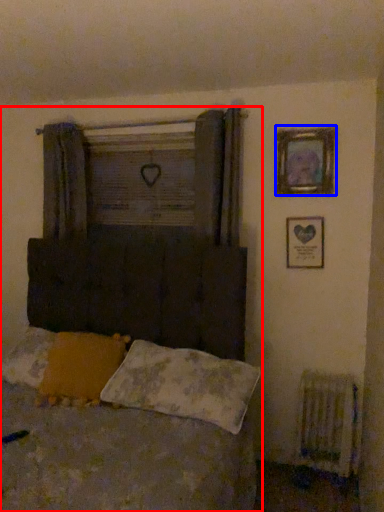
Question: Which object appears farthest to the camera in this image, bed (highlighted by a red box) or picture frame (highlighted by a blue box)?

Choices:
 (A) bed
 (B) picture frame

Answer: (B)